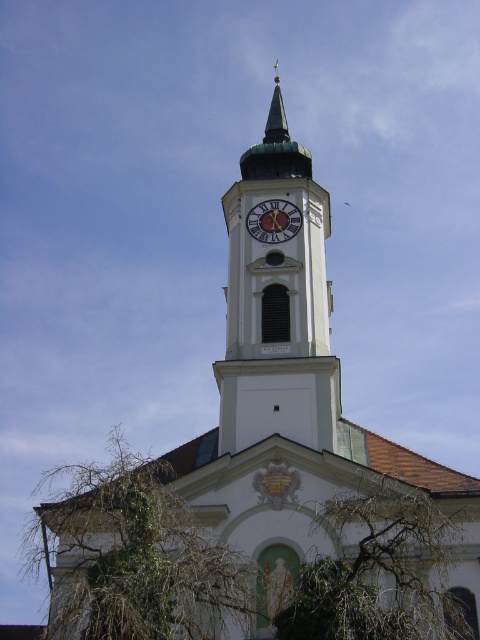
In the scene shown: Is white stone clock tower at center positioned before green leafy tree at lower left?

That is False.

Between white stone clock tower at center and green leafy tree at lower left, which one is positioned higher?

Positioned higher is white stone clock tower at center.

Which is in front, point (295, 276) or point (205, 627)?

Point (205, 627)

What are the coordinates of `white stone clock tower at center` in the screenshot? It's located at (276, 298).

In the scene shown: Does green leafy tree at center have a larger size compared to gold metallic clock at center?

Correct, green leafy tree at center is larger in size than gold metallic clock at center.

Does point (440, 614) lie behind point (250, 232)?

No, (440, 614) is closer to viewer.

What are the coordinates of `green leafy tree at center` in the screenshot? It's located at (381, 573).

Who is taller, white stone clock tower at center or gold metallic clock at center?

Standing taller between the two is white stone clock tower at center.

Which is below, white stone clock tower at center or gold metallic clock at center?

gold metallic clock at center

Is point (320, 225) behind point (283, 205)?

Yes, point (320, 225) is behind point (283, 205).

Locate an element on the screen. Image resolution: width=480 pixels, height=640 pixels. white stone clock tower at center is located at coordinates (276, 298).